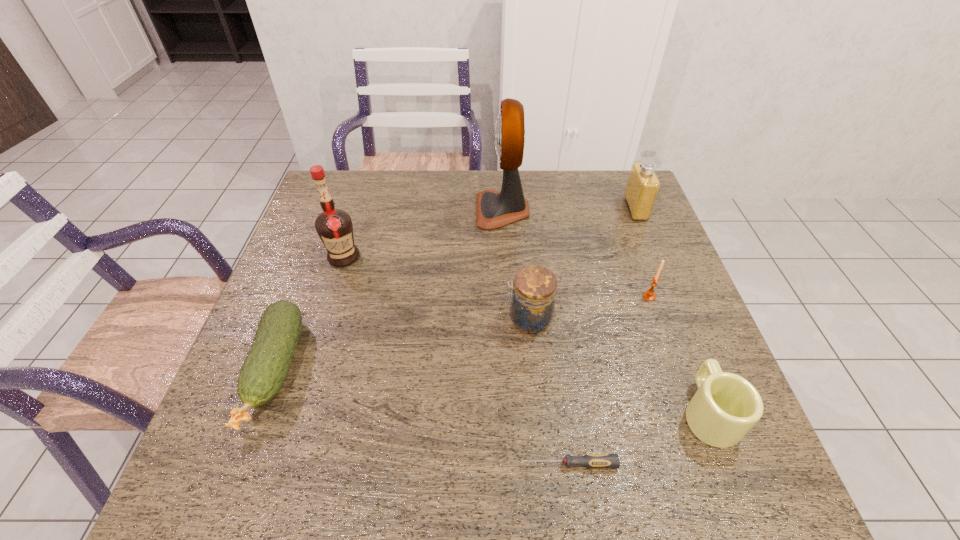
The width and height of the screenshot is (960, 540). I want to click on vacant space located 0.120m on the back of the fourth farthest object, so click(636, 259).

The width and height of the screenshot is (960, 540). Find the location of `blank space located 0.380m with the handle on the side of the sixth tallest object`. blank space located 0.380m with the handle on the side of the sixth tallest object is located at coordinates (649, 257).

In order to click on vacant space located 0.380m with the handle on the side of the sixth tallest object in this screenshot , I will do `click(649, 257)`.

The width and height of the screenshot is (960, 540). I want to click on vacant space located 0.280m with the handle on the side of the sixth tallest object, so click(659, 284).

Locate an element on the screen. The height and width of the screenshot is (540, 960). vacant space located 0.340m insert the screwdriver into a screw head is located at coordinates (337, 464).

I want to click on vacant space located 0.320m insert the screwdriver into a screw head, so pos(348,464).

The image size is (960, 540). I want to click on free location located 0.200m insert the screwdriver into a screw head, so click(x=413, y=464).

Locate an element on the screen. fan that is at the far edge is located at coordinates (494, 209).

The height and width of the screenshot is (540, 960). Identify the location of perfume that is at the far edge. (643, 185).

Locate an element on the screen. This screenshot has width=960, height=540. mug at the near edge is located at coordinates (726, 406).